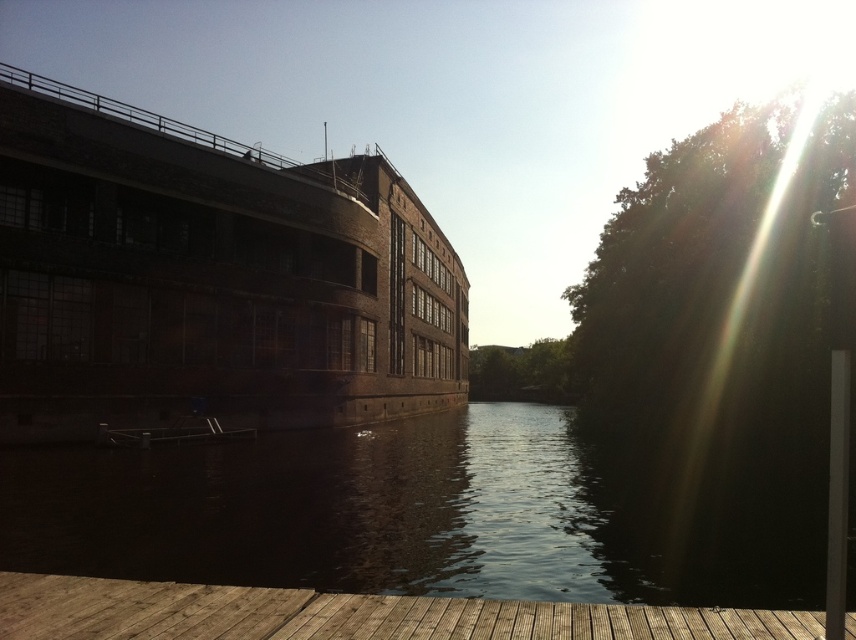
Question: Which object is the farthest from the wooden at lower left?

Choices:
 (A) dark reflective water at center
 (B) dark gray metallic boat at center

Answer: (B)

Question: Estimate the real-world distances between objects in this image. Which object is farther from the dark gray metallic boat at center?

Choices:
 (A) wooden at lower left
 (B) dark reflective water at center

Answer: (A)

Question: Which point is closer to the camera?

Choices:
 (A) wooden at lower left
 (B) dark reflective water at center
 (C) dark gray metallic boat at center

Answer: (A)

Question: Observing the image, what is the correct spatial positioning of wooden at lower left in reference to dark gray metallic boat at center?

Choices:
 (A) left
 (B) right

Answer: (B)

Question: Does dark reflective water at center have a lesser width compared to wooden at lower left?

Choices:
 (A) yes
 (B) no

Answer: (B)

Question: Does dark reflective water at center have a smaller size compared to wooden at lower left?

Choices:
 (A) no
 (B) yes

Answer: (A)